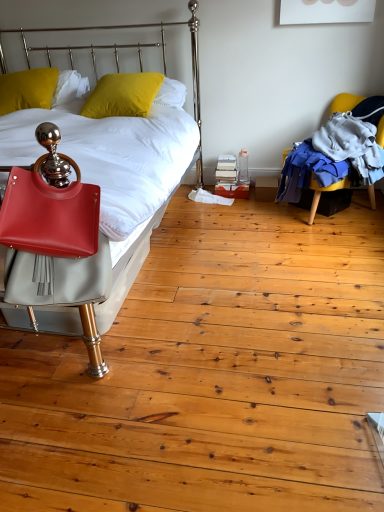
Describe the element at coordinates (323, 191) in the screenshot. I see `yellow fabric chair at right` at that location.

From the picture: Measure the distance between point (374, 200) and camera.

Point (374, 200) is 2.74 meters away from camera.

Describe the element at coordinates (50, 214) in the screenshot. I see `matte red handbag at left` at that location.

In order to face matte red handbag at left, should I rotate leftwards or rightwards?

Rotate left and turn 18.778 degrees.

Locate an element on the screen. This screenshot has width=384, height=512. yellow matte pillow at upper left, which is counted as the 1th pillow, starting from the left is located at coordinates (27, 89).

Would you say matte red handbag at left is to the left or to the right of yellow matte pillow at upper left, which is the second pillow in right-to-left order, in the picture?

From the image, it's evident that matte red handbag at left is to the right of yellow matte pillow at upper left, which is the second pillow in right-to-left order.

Are matte red handbag at left and yellow matte pillow at upper left, which is counted as the 1th pillow, starting from the left, beside each other?

No, matte red handbag at left is not next to yellow matte pillow at upper left, which is counted as the 1th pillow, starting from the left.

What's the angular difference between matte red handbag at left and yellow matte pillow at upper left, which is counted as the 1th pillow, starting from the left,'s facing directions?

There is a 2.74-degree angle between the facing directions of matte red handbag at left and yellow matte pillow at upper left, which is counted as the 1th pillow, starting from the left.

Considering the sizes of objects matte red handbag at left and yellow matte pillow at upper left, which is the second pillow in right-to-left order, in the image provided, who is taller, matte red handbag at left or yellow matte pillow at upper left, which is the second pillow in right-to-left order,?

Standing taller between the two is matte red handbag at left.

How different are the orientations of yellow fabric chair at right and yellow matte pillow at upper left, which is counted as the 1th pillow, starting from the left, in degrees?

The angle between the facing direction of yellow fabric chair at right and the facing direction of yellow matte pillow at upper left, which is counted as the 1th pillow, starting from the left, is 62.2 degrees.

Can you confirm if yellow fabric chair at right is positioned to the left of yellow matte pillow at upper left, which is the second pillow in right-to-left order?

No, yellow fabric chair at right is not to the left of yellow matte pillow at upper left, which is the second pillow in right-to-left order.

Based on the photo, who is more distant, yellow fabric chair at right or yellow matte pillow at upper left, which is the second pillow in right-to-left order?

yellow matte pillow at upper left, which is the second pillow in right-to-left order.

Which is nearer, (343, 100) or (47, 79)?

Clearly, point (343, 100) is more distant from the camera than point (47, 79).

Is yellow matte pillow at upper left, which is counted as the 1th pillow, starting from the left, completely or partially outside of matte red handbag at left?

Yes, yellow matte pillow at upper left, which is counted as the 1th pillow, starting from the left, is outside of matte red handbag at left.

Looking at this image, are yellow matte pillow at upper left, which is the second pillow in right-to-left order, and matte red handbag at left located far from each other?

Absolutely, yellow matte pillow at upper left, which is the second pillow in right-to-left order, is distant from matte red handbag at left.

Between yellow matte pillow at upper left, which is counted as the 1th pillow, starting from the left, and matte red handbag at left, which one has smaller width?

matte red handbag at left.

Can you confirm if yellow matte pillow at upper left, the 2th pillow viewed from the left, is positioned to the left of matte red handbag at left?

Yes.

Considering the sizes of objects yellow matte pillow at upper left, the 2th pillow viewed from the left, and matte red handbag at left in the image provided, who is wider, yellow matte pillow at upper left, the 2th pillow viewed from the left, or matte red handbag at left?

yellow matte pillow at upper left, the 2th pillow viewed from the left.

Is yellow matte pillow at upper left, the 2th pillow viewed from the left, inside or outside of matte red handbag at left?

yellow matte pillow at upper left, the 2th pillow viewed from the left, is not inside matte red handbag at left, it's outside.

Measure the distance from matte leather bed at left to yellow matte pillow at upper left, which is the first pillow in right-to-left order.

matte leather bed at left and yellow matte pillow at upper left, which is the first pillow in right-to-left order, are 1.22 meters apart.

Considering the sizes of objects matte leather bed at left and yellow matte pillow at upper left, the 2th pillow viewed from the left, in the image provided, who is shorter, matte leather bed at left or yellow matte pillow at upper left, the 2th pillow viewed from the left,?

With less height is yellow matte pillow at upper left, the 2th pillow viewed from the left.

Looking at this image, is matte leather bed at left to the right of yellow matte pillow at upper left, the 2th pillow viewed from the left, from the viewer's perspective?

No, matte leather bed at left is not to the right of yellow matte pillow at upper left, the 2th pillow viewed from the left.

From a real-world perspective, is matte leather bed at left above or below yellow matte pillow at upper left, the 2th pillow viewed from the left?

Clearly, from a real-world perspective, matte leather bed at left is below yellow matte pillow at upper left, the 2th pillow viewed from the left.

Is yellow matte pillow at upper left, which is counted as the 1th pillow, starting from the left, placed right next to yellow fabric chair at right?

No, yellow matte pillow at upper left, which is counted as the 1th pillow, starting from the left, is not beside yellow fabric chair at right.

From the picture: From the image's perspective, is yellow matte pillow at upper left, which is counted as the 1th pillow, starting from the left, above yellow fabric chair at right?

Yes, from the image's perspective, yellow matte pillow at upper left, which is counted as the 1th pillow, starting from the left, is above yellow fabric chair at right.

Considering their positions, is yellow matte pillow at upper left, which is counted as the 1th pillow, starting from the left, located in front of or behind yellow fabric chair at right?

In the image, yellow matte pillow at upper left, which is counted as the 1th pillow, starting from the left, appears behind yellow fabric chair at right.

In terms of height, does yellow matte pillow at upper left, which is counted as the 1th pillow, starting from the left, look taller or shorter compared to yellow fabric chair at right?

In the image, yellow matte pillow at upper left, which is counted as the 1th pillow, starting from the left, appears to be shorter than yellow fabric chair at right.

Which is more to the left, matte leather bed at left or yellow fabric chair at right?

matte leather bed at left is more to the left.

Image resolution: width=384 pixels, height=512 pixels. Find the location of `bed in front of the yellow fabric chair at right`. bed in front of the yellow fabric chair at right is located at coordinates (56, 247).

Is matte leather bed at left facing towards yellow fabric chair at right?

No, matte leather bed at left does not turn towards yellow fabric chair at right.

Which point is more forward, (85, 290) or (338, 187)?

The point (85, 290) is in front.

Find the location of a particular element. pillow that is the 2nd one above the matte red handbag at left (from a real-world perspective) is located at coordinates (27, 89).

Locate an element on the screen. chair to the right of yellow matte pillow at upper left, which is the second pillow in right-to-left order is located at coordinates (323, 191).

When comparing their distances from yellow matte pillow at upper left, which is counted as the 1th pillow, starting from the left, does yellow fabric chair at right or yellow matte pillow at upper left, the 2th pillow viewed from the left, seem closer?

yellow matte pillow at upper left, the 2th pillow viewed from the left, lies closer to yellow matte pillow at upper left, which is counted as the 1th pillow, starting from the left, than the other object.

Consider the image. Looking at the image, which one is located closer to matte leather bed at left, yellow matte pillow at upper left, which is the second pillow in right-to-left order, or yellow matte pillow at upper left, which is the first pillow in right-to-left order?

Based on the image, yellow matte pillow at upper left, which is the first pillow in right-to-left order, appears to be nearer to matte leather bed at left.

Based on the photo, estimate the real-world distances between objects in this image. Which object is further from yellow fabric chair at right, yellow matte pillow at upper left, the 2th pillow viewed from the left, or matte leather bed at left?

The object further to yellow fabric chair at right is matte leather bed at left.

Based on the photo, estimate the real-world distances between objects in this image. Which object is further from yellow matte pillow at upper left, the 2th pillow viewed from the left, matte red handbag at left or matte leather bed at left?

matte red handbag at left is further to yellow matte pillow at upper left, the 2th pillow viewed from the left.

When comparing their distances from matte leather bed at left, does matte red handbag at left or yellow fabric chair at right seem closer?

Among the two, matte red handbag at left is located nearer to matte leather bed at left.

Based on their spatial positions, is yellow matte pillow at upper left, which is the second pillow in right-to-left order, or matte leather bed at left further from matte red handbag at left?

yellow matte pillow at upper left, which is the second pillow in right-to-left order.

Estimate the real-world distances between objects in this image. Which object is further from yellow fabric chair at right, matte leather bed at left or yellow matte pillow at upper left, which is the first pillow in right-to-left order?

Based on the image, matte leather bed at left appears to be further to yellow fabric chair at right.

From the image, which object appears to be farther from yellow fabric chair at right, matte leather bed at left or matte red handbag at left?

matte red handbag at left is further to yellow fabric chair at right.

You are a GUI agent. You are given a task and a screenshot of the screen. Output one action in this format:
    pyautogui.click(x=<x>, y=<y>)
    Task: Click on the handbag between matte leather bed at left and yellow matte pillow at upper left, which is counted as the 1th pillow, starting from the left, in the front-back direction
    
    Given the screenshot: What is the action you would take?
    pyautogui.click(x=50, y=214)

Where is `handbag between yellow matte pillow at upper left, the 2th pillow viewed from the left, and yellow fabric chair at right, in the horizontal direction`? The height and width of the screenshot is (512, 384). handbag between yellow matte pillow at upper left, the 2th pillow viewed from the left, and yellow fabric chair at right, in the horizontal direction is located at coordinates (50, 214).

Locate an element on the screen. The width and height of the screenshot is (384, 512). bed situated between yellow matte pillow at upper left, which is the second pillow in right-to-left order, and yellow fabric chair at right from left to right is located at coordinates (56, 247).

The image size is (384, 512). I want to click on pillow between yellow matte pillow at upper left, which is the second pillow in right-to-left order, and yellow fabric chair at right, in the horizontal direction, so click(123, 95).